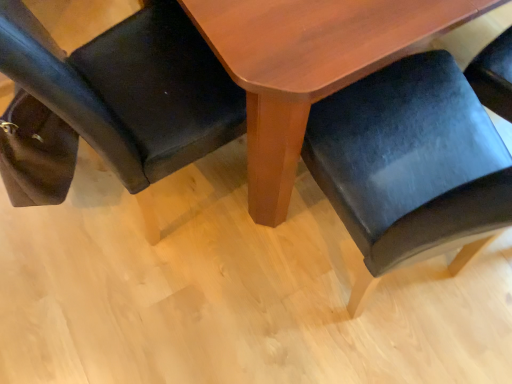
Question: Looking at their shapes, would you say matte black chair at lower left, the first chair positioned from the left, is wider or thinner than velvet black chair at lower right, acting as the 2th chair starting from the left?

Choices:
 (A) thin
 (B) wide

Answer: (B)

Question: From a real-world perspective, relative to velvet black chair at lower right, acting as the 2th chair starting from the left, is matte black chair at lower left, the first chair positioned from the left, vertically above or below?

Choices:
 (A) above
 (B) below

Answer: (B)

Question: Which object is positioned closest to the wooden table at center?

Choices:
 (A) matte black chair at lower left, the first chair positioned from the left
 (B) velvet black chair at lower right, which is counted as the first chair, starting from the right

Answer: (B)

Question: Based on their relative distances, which object is farther from the wooden table at center?

Choices:
 (A) matte black chair at lower left, the first chair positioned from the left
 (B) velvet black chair at lower right, which is counted as the first chair, starting from the right

Answer: (A)